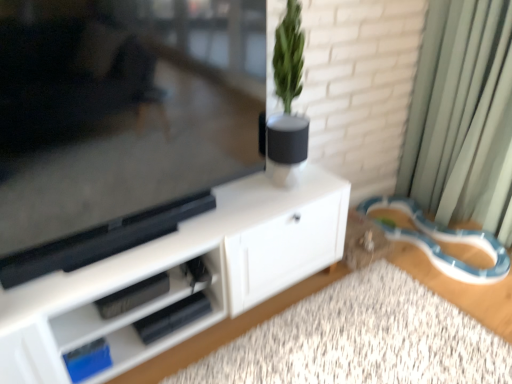
Find the location of a particular element. This screenshot has height=384, width=512. vacant position to the left of white matte vase at center is located at coordinates (244, 190).